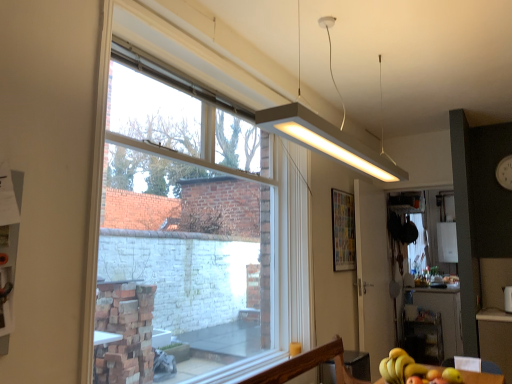
Question: Which direction should I rotate to look at white matte rectangular light fixture at upper center?

Choices:
 (A) right
 (B) left

Answer: (A)

Question: Is yellow matte bananas at lower right beside white plastic clock at upper right?

Choices:
 (A) no
 (B) yes

Answer: (A)

Question: Is white plastic clock at upper right a part of yellow matte bananas at lower right?

Choices:
 (A) no
 (B) yes

Answer: (A)

Question: Is yellow matte bananas at lower right closer to camera compared to white plastic clock at upper right?

Choices:
 (A) no
 (B) yes

Answer: (B)

Question: Is yellow matte bananas at lower right to the right of white plastic clock at upper right from the viewer's perspective?

Choices:
 (A) yes
 (B) no

Answer: (B)

Question: Can you confirm if yellow matte bananas at lower right is thinner than white plastic clock at upper right?

Choices:
 (A) yes
 (B) no

Answer: (B)

Question: From the image's perspective, is yellow matte bananas at lower right on top of white plastic clock at upper right?

Choices:
 (A) no
 (B) yes

Answer: (A)

Question: From a real-world perspective, is white glossy screen door at center positioned under clear glass window at center based on gravity?

Choices:
 (A) yes
 (B) no

Answer: (A)

Question: Is white glossy screen door at center shorter than clear glass window at center?

Choices:
 (A) yes
 (B) no

Answer: (B)

Question: Can you confirm if white glossy screen door at center is wider than clear glass window at center?

Choices:
 (A) no
 (B) yes

Answer: (A)

Question: Considering the relative positions of white glossy screen door at center and clear glass window at center in the image provided, is white glossy screen door at center to the left of clear glass window at center from the viewer's perspective?

Choices:
 (A) no
 (B) yes

Answer: (A)

Question: Is white glossy screen door at center next to clear glass window at center?

Choices:
 (A) yes
 (B) no

Answer: (B)

Question: Is white glossy screen door at center thinner than clear glass window at center?

Choices:
 (A) yes
 (B) no

Answer: (A)

Question: Does yellow matte bananas at lower right have a lesser height compared to clear glass window at center?

Choices:
 (A) no
 (B) yes

Answer: (B)